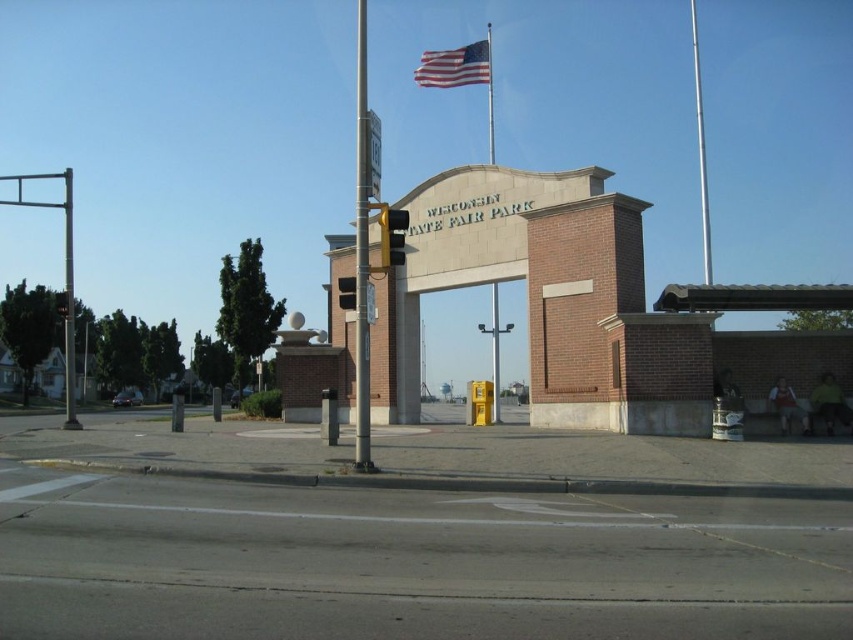
Question: Among these points, which one is farthest from the camera?

Choices:
 (A) (427, 77)
 (B) (704, 273)

Answer: (B)

Question: Which of the following is the farthest from the observer?

Choices:
 (A) (396, 228)
 (B) (340, 296)
 (C) (67, 298)

Answer: (C)

Question: Which object is closer to the camera taking this photo?

Choices:
 (A) american flag at upper center
 (B) metallic flagpole at upper center

Answer: (A)

Question: Is metallic pole at center to the right of american flag at upper center from the viewer's perspective?

Choices:
 (A) yes
 (B) no

Answer: (B)

Question: Where is metallic pole at center located in relation to yellow matte traffic light at center in the image?

Choices:
 (A) below
 (B) above

Answer: (B)

Question: Does metallic pole at center appear on the left side of yellow matte traffic light at center?

Choices:
 (A) yes
 (B) no

Answer: (A)